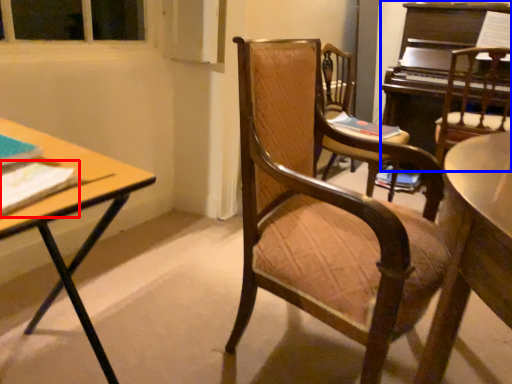
Question: Which point is closer to the camera, book (highlighted by a red box) or piano (highlighted by a blue box)?

Choices:
 (A) book
 (B) piano

Answer: (A)